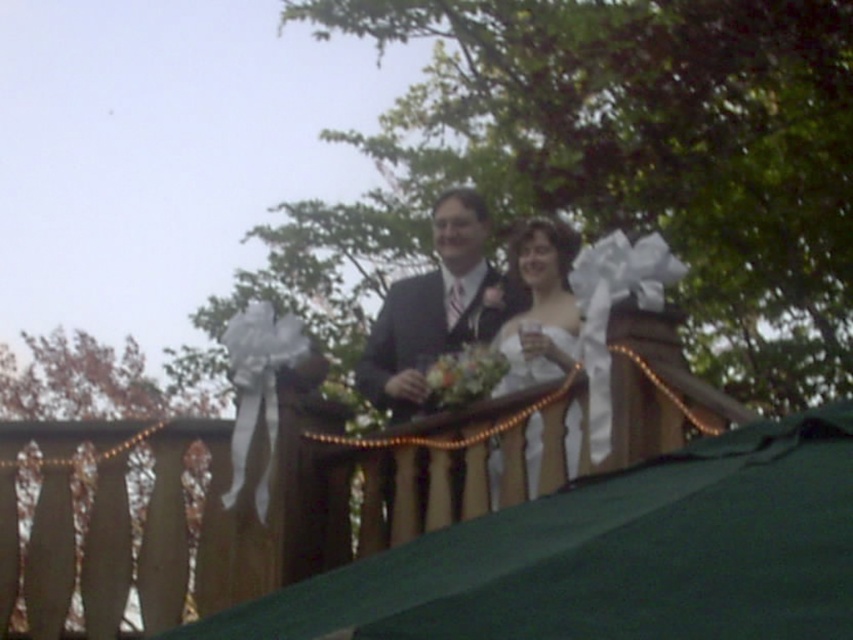
You are a photographer positioned at the center of the balcony. You notice two points marked in the scene. Which point, point (x=430, y=326) or point (x=577, y=426), is closer to your camera lens?

Point (x=430, y=326) is further to the viewer than point (x=577, y=426), so the closer point to your camera lens would be point (x=577, y=426).

You are a photographer positioned at the lower edge of the image. You want to capture a shot of the green fabric canopy at upper center without including the couple in the frame. Based on its position, can you estimate whether the canopy is above or below the center of the image?

The green fabric canopy at upper center is located at point [614,556] in 2D coordinates. Since the y coordinate 0.721 is above the center point of 0.5, the canopy is positioned above the center of the image.